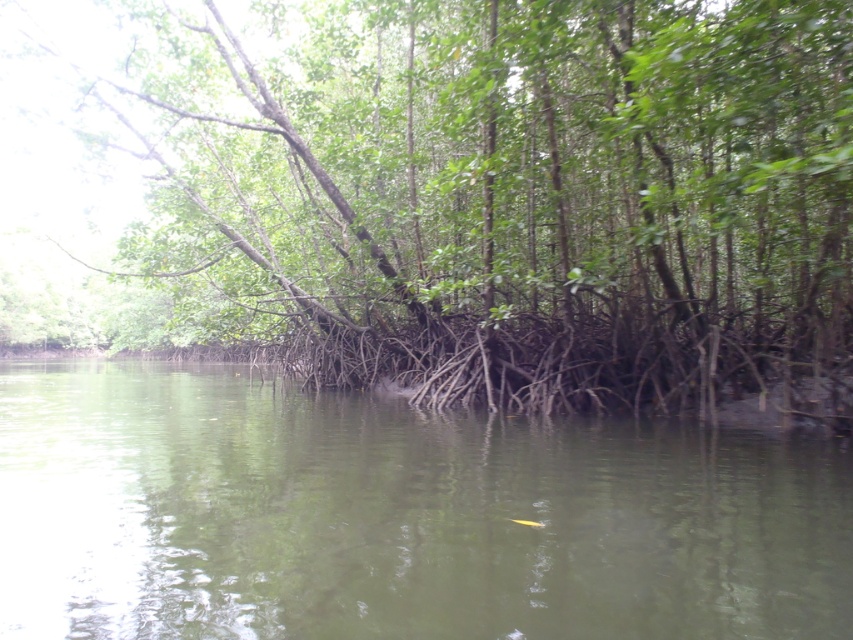
You are navigating a small boat through the mangrove forest and want to determine the distance between two points marked on your map. The first point is at coordinates point (376, 369) and the second is at point (561, 493). Based on the scene, which point is closer to your boat?

Point (376, 369) is closer to the viewer than point (561, 493), so the first point is closer to your boat.

You are a drone operator trying to capture a photo of the green leafy tree at center. The drone is currently at point 0.309, 0.593. Is the drone already positioned directly above the tree?

The position of green leafy tree at center is at point (x=505, y=196), so yes, the drone is already positioned directly above the green leafy tree at center.